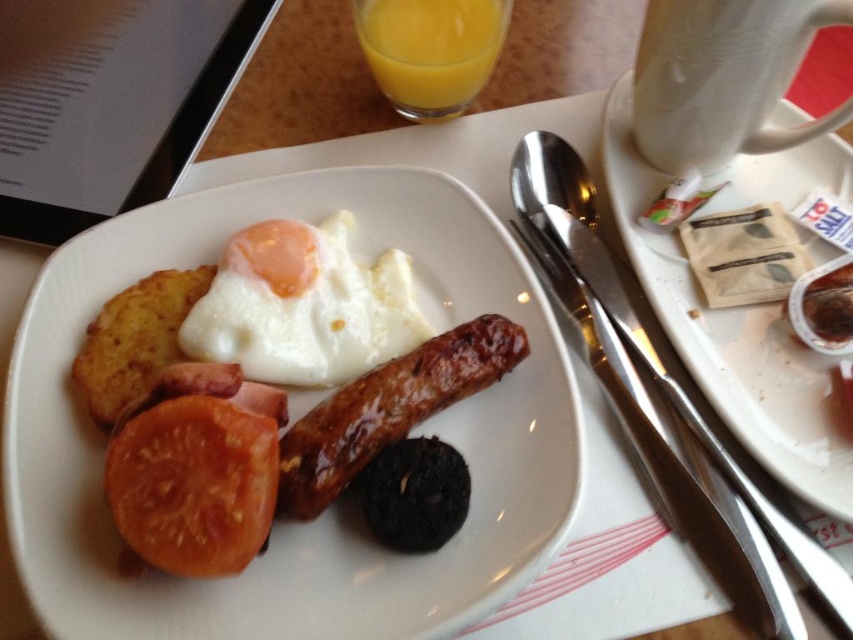
You are a photographer taking a closeup shot of the breakfast plate. You notice two points marked in the image at coordinates point [650,8] and point [132,547]. If you want to focus on the point that is closer to your camera, which coordinate should you adjust your lens to?

Point [132,547] is closer to the camera than point [650,8], so you should adjust your lens to focus on point [132,547].

You are a barista preparing a coffee order. You need to place the white ceramic mug at upper right and the red matte tomato at lower left on the counter. Given that the counter space is limited, which object should you place first to maximize space efficiency?

The white ceramic mug at upper right has a greater width than the red matte tomato at lower left. To maximize space efficiency, place the wider item first, so place the white ceramic mug at upper right first.

Where is the slightly browned ceramic plate at center located in the image?

The slightly browned ceramic plate at center is located at point (329,509).